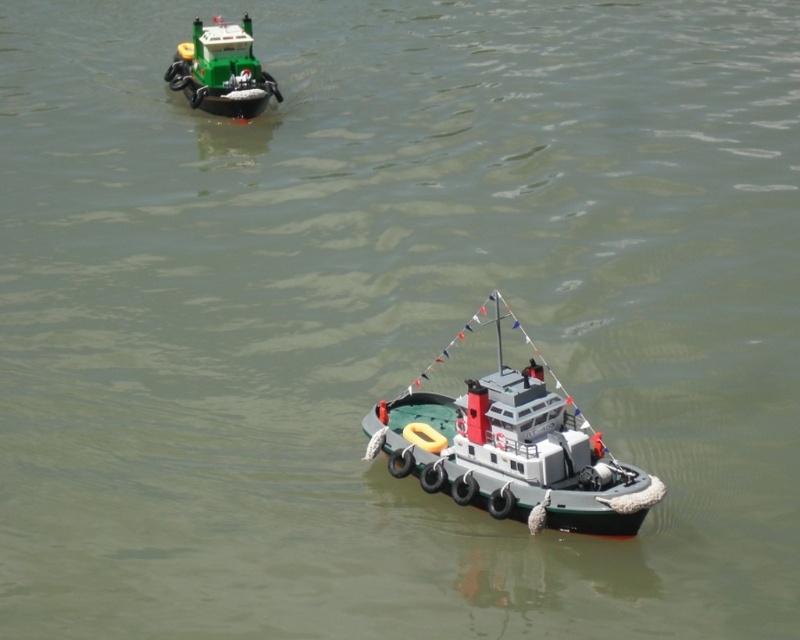
Question: Can you confirm if gray rubber boat at center is positioned above green plastic tugboat at upper left?

Choices:
 (A) no
 (B) yes

Answer: (A)

Question: Can you confirm if gray rubber boat at center is thinner than green plastic tugboat at upper left?

Choices:
 (A) yes
 (B) no

Answer: (B)

Question: Among these points, which one is nearest to the camera?

Choices:
 (A) (496, 403)
 (B) (194, 96)

Answer: (A)

Question: In this image, where is gray rubber boat at center located relative to green plastic tugboat at upper left?

Choices:
 (A) right
 (B) left

Answer: (A)